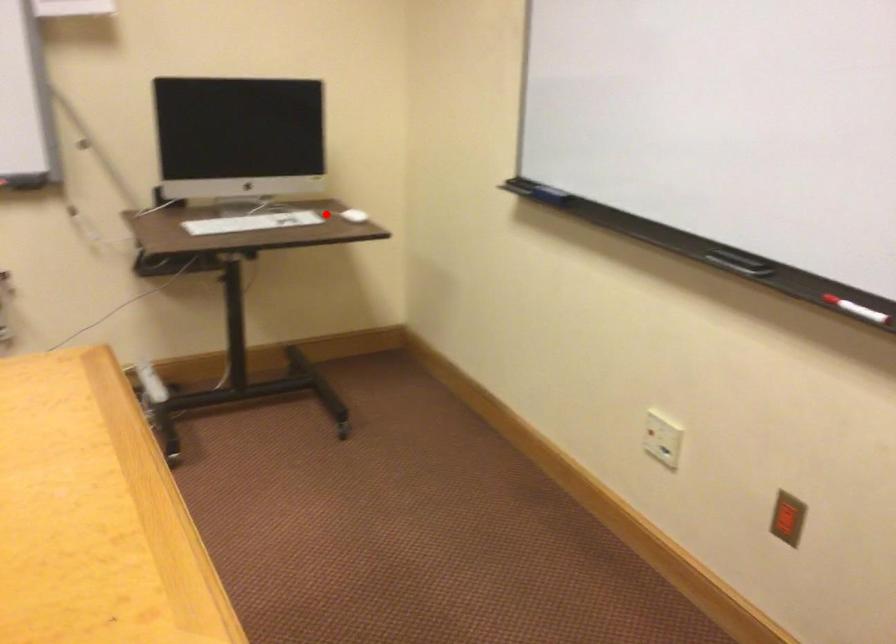
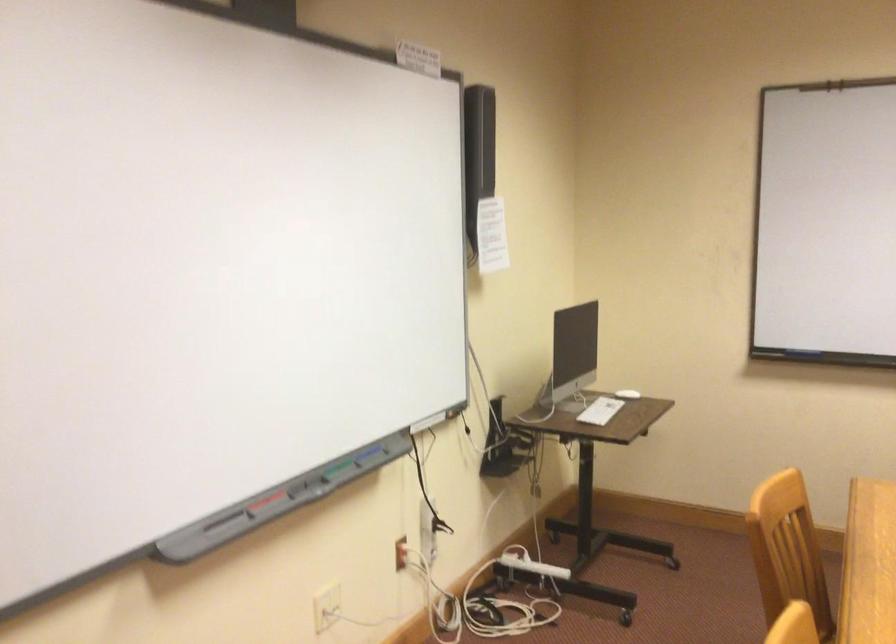
Question: I am providing you with two images of the same scene from different viewpoints. A red point is shown in image1. For the corresponding object point in image2, is it positioned nearer or farther from the camera?

Choices:
 (A) Nearer
 (B) Farther

Answer: (B)